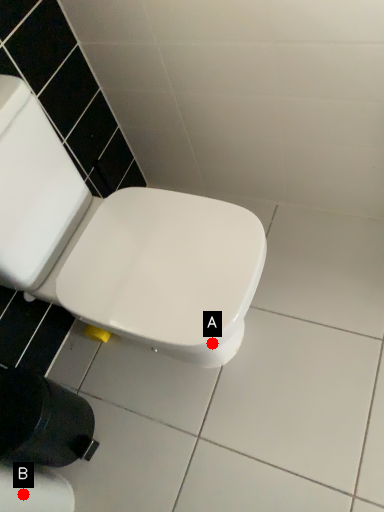
Question: Two points are circled on the image, labeled by A and B beside each circle. Which point is farther to the camera?

Choices:
 (A) A is further
 (B) B is further

Answer: (B)